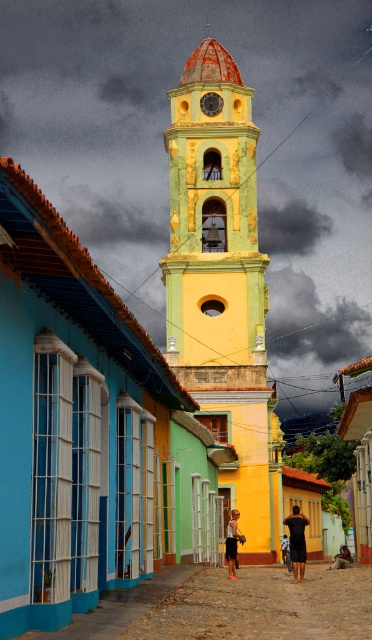
You are standing at the entrance of the historic town and want to take a photo of the cobblestone street at center. Where exactly should you position yourself to capture it in the frame?

You should position yourself at point (233, 608) to capture the cobblestone street at center in the frame.